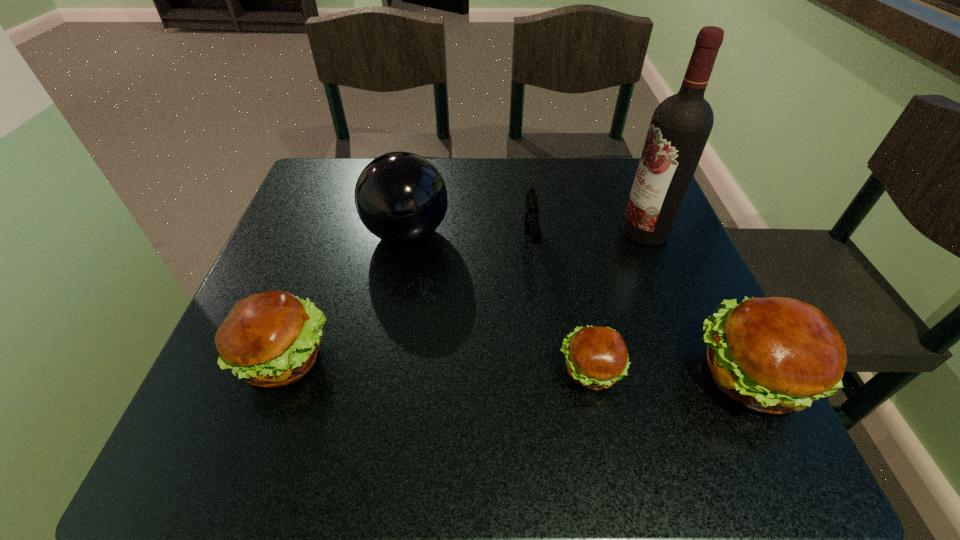
This screenshot has width=960, height=540. In order to click on vacant space located on the left of the shortest hamburger in this screenshot , I will do `click(362, 370)`.

Identify the location of vacant space located 0.220m on the left of the rightmost hamburger. (559, 377).

Find the location of a particular element. blank space located 0.120m on the front-facing side of the pistol is located at coordinates [x=540, y=316].

Find the location of a particular element. vacant space situated on the side of the bowling ball with the finger holes is located at coordinates (579, 233).

Image resolution: width=960 pixels, height=540 pixels. In order to click on vacant space positioned 0.340m on the label of the tallest object in this screenshot , I will do `click(470, 231)`.

You are a GUI agent. You are given a task and a screenshot of the screen. Output one action in this format:
    pyautogui.click(x=<x>, y=<y>)
    Task: Click on the free spot located 0.150m on the label of the tallest object
    Image resolution: width=960 pixels, height=540 pixels.
    Given the screenshot: What is the action you would take?
    pos(555,231)

Find the location of `free region located on the label of the tallest object`. free region located on the label of the tallest object is located at coordinates click(470, 231).

You are a GUI agent. You are given a task and a screenshot of the screen. Output one action in this format:
    pyautogui.click(x=<x>, y=<y>)
    Task: Click on the object that is at the far edge
    This screenshot has width=960, height=540.
    Given the screenshot: What is the action you would take?
    pyautogui.click(x=400, y=197)

You are a GUI agent. You are given a task and a screenshot of the screen. Output one action in this format:
    pyautogui.click(x=<x>, y=<y>)
    Task: Click on the object at the left edge
    The image size is (960, 540).
    Given the screenshot: What is the action you would take?
    pyautogui.click(x=270, y=339)

I want to click on hamburger that is positioned at the right edge, so click(x=774, y=355).